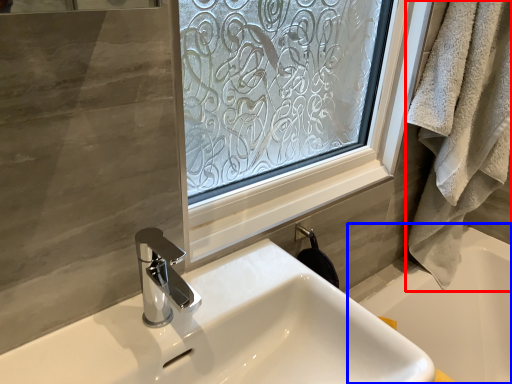
Question: Which of the following is the farthest to the observer, bath towel (highlighted by a red box) or bath (highlighted by a blue box)?

Choices:
 (A) bath towel
 (B) bath

Answer: (B)